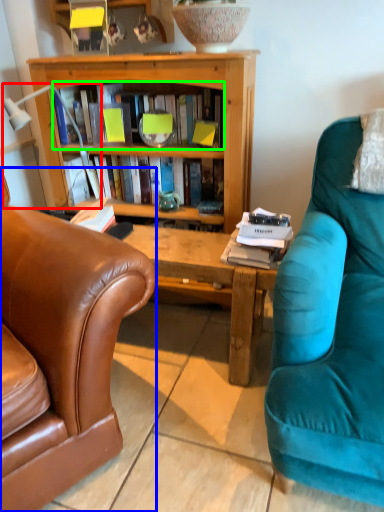
Question: Which is nearer to the lamp (highlighted by a red box)? chair (highlighted by a blue box) or book (highlighted by a green box).

Choices:
 (A) chair
 (B) book

Answer: (B)